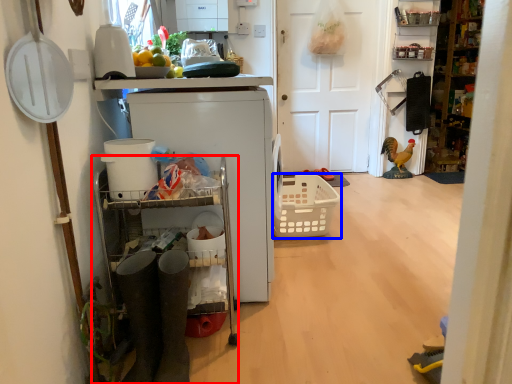
Question: Which point is closer to the camera, cabinetry (highlighted by a red box) or basket (highlighted by a blue box)?

Choices:
 (A) cabinetry
 (B) basket

Answer: (A)